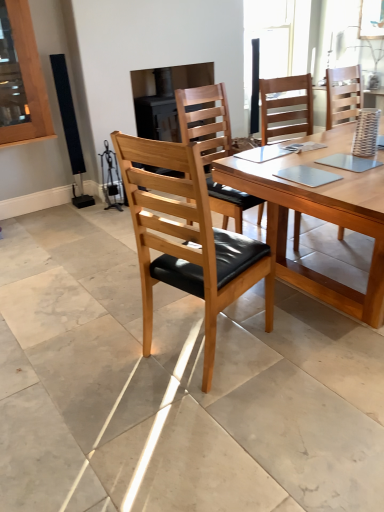
Question: Is light brown wood chair at center, marked as the third chair in a left-to-right arrangement, taller than natural wood/black leather chair at center, the third chair in the right-to-left sequence?

Choices:
 (A) yes
 (B) no

Answer: (A)

Question: Does light brown wood chair at center, the 1th chair in the right-to-left sequence, contain natural wood/black leather chair at center, the third chair in the right-to-left sequence?

Choices:
 (A) no
 (B) yes

Answer: (A)

Question: Does light brown wood chair at center, the 1th chair in the right-to-left sequence, turn towards natural wood/black leather chair at center, the first chair from the left?

Choices:
 (A) no
 (B) yes

Answer: (A)

Question: Is light brown wood chair at center, the 1th chair in the right-to-left sequence, touching natural wood/black leather chair at center, the first chair from the left?

Choices:
 (A) no
 (B) yes

Answer: (A)

Question: From a real-world perspective, is light brown wood chair at center, marked as the third chair in a left-to-right arrangement, positioned over natural wood/black leather chair at center, the third chair in the right-to-left sequence, based on gravity?

Choices:
 (A) no
 (B) yes

Answer: (A)

Question: Considering the relative positions of light brown wood chair at center, marked as the third chair in a left-to-right arrangement, and wooden chair with black cushion at center, the second chair from the right, in the image provided, is light brown wood chair at center, marked as the third chair in a left-to-right arrangement, to the left or to the right of wooden chair with black cushion at center, the second chair from the right,?

Choices:
 (A) right
 (B) left

Answer: (A)

Question: Is point coord(294,112) positioned closer to the camera than point coord(190,121)?

Choices:
 (A) closer
 (B) farther

Answer: (B)

Question: Looking at their shapes, would you say light brown wood chair at center, marked as the third chair in a left-to-right arrangement, is wider or thinner than wooden chair with black cushion at center, the second chair from the right?

Choices:
 (A) wide
 (B) thin

Answer: (A)

Question: From the image's perspective, is light brown wood chair at center, the 1th chair in the right-to-left sequence, above or below wooden chair with black cushion at center, the second chair viewed from the left?

Choices:
 (A) above
 (B) below

Answer: (A)

Question: Is transparent glass window at upper center wider or thinner than light brown wood chair at center, the 1th chair in the right-to-left sequence?

Choices:
 (A) wide
 (B) thin

Answer: (B)

Question: Considering the positions of transparent glass window at upper center and light brown wood chair at center, the 1th chair in the right-to-left sequence, in the image, is transparent glass window at upper center taller or shorter than light brown wood chair at center, the 1th chair in the right-to-left sequence,?

Choices:
 (A) tall
 (B) short

Answer: (B)

Question: From the image's perspective, is transparent glass window at upper center located above or below light brown wood chair at center, marked as the third chair in a left-to-right arrangement?

Choices:
 (A) above
 (B) below

Answer: (A)

Question: In the image, is transparent glass window at upper center positioned in front of or behind light brown wood chair at center, marked as the third chair in a left-to-right arrangement?

Choices:
 (A) behind
 (B) front

Answer: (A)

Question: Relative to natural wood/black leather chair at center, the third chair in the right-to-left sequence, is light brown wood chair at center, marked as the third chair in a left-to-right arrangement, in front or behind?

Choices:
 (A) front
 (B) behind

Answer: (B)

Question: Is light brown wood chair at center, marked as the third chair in a left-to-right arrangement, wider or thinner than natural wood/black leather chair at center, the first chair from the left?

Choices:
 (A) thin
 (B) wide

Answer: (B)